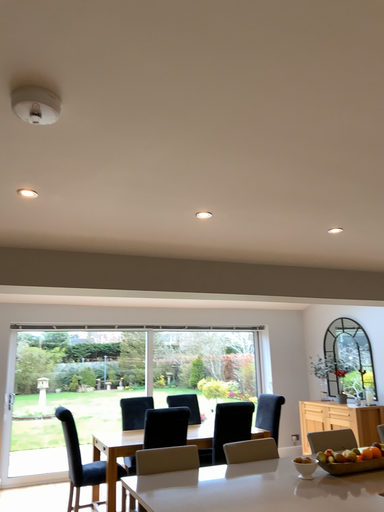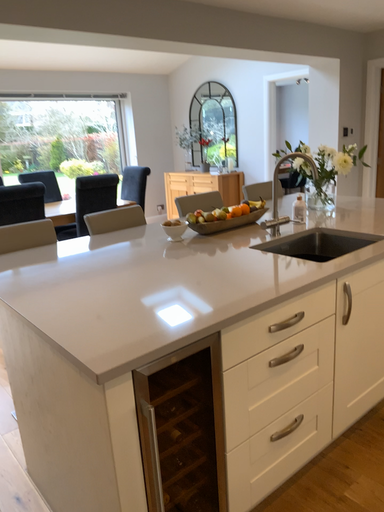
Question: How did the camera likely rotate when shooting the video?

Choices:
 (A) rotated left
 (B) rotated right

Answer: (B)